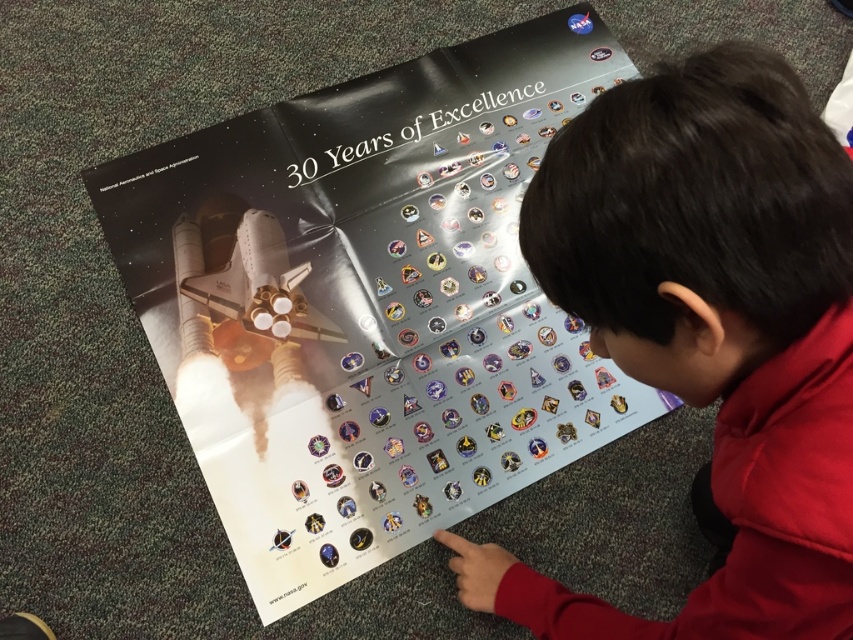
Question: Can you confirm if metallic silver poster at center is bigger than dark brown hair at upper center?

Choices:
 (A) no
 (B) yes

Answer: (B)

Question: In this image, where is metallic silver poster at center located relative to dark brown hair at upper center?

Choices:
 (A) below
 (B) above

Answer: (B)

Question: Which object appears closest to the camera in this image?

Choices:
 (A) dark brown hair at upper center
 (B) metallic silver poster at center

Answer: (A)

Question: Which point is closer to the camera taking this photo?

Choices:
 (A) (251, 228)
 (B) (758, 458)

Answer: (B)

Question: Where is metallic silver poster at center located in relation to dark brown hair at upper center in the image?

Choices:
 (A) right
 (B) left

Answer: (B)